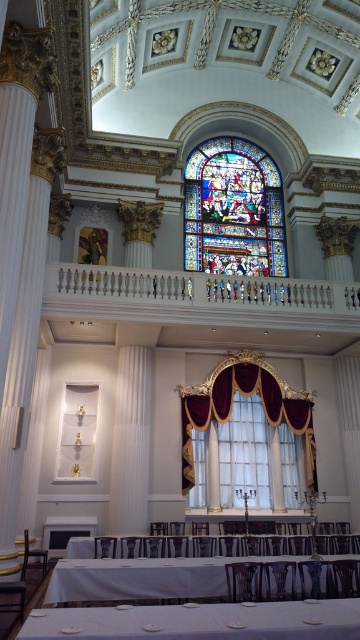
You are a guest at a formal event in this room and want to sit at the white cloth table at lower center. To do so, you need to pass through the area near the velvet curtain at right. Is the table positioned in a way that you can easily reach it without having to go around the curtain?

The white cloth table at lower center is located below the velvet curtain at right, meaning it is positioned directly underneath the curtain. This placement allows you to approach the table by moving straight towards it beneath the curtain, so you can easily reach it without needing to go around the curtain.

You are standing in the room and want to determine the spatial relationship between two points marked in the image. Which point is closer to you, point (219, 611) or point (222, 365)?

Point (219, 611) is in front of point (222, 365), so it is closer to you.

You are standing at the entrance of the room and want to place a decorative vase on the white glossy table at lower center. Based on the coordinates provided, in which direction should you move to reach the table?

The white glossy table at lower center is located at coordinates point (x=191, y=545). Since the coordinate system typically places the origin at the bottom left corner, moving towards the right and slightly upwards from the entrance would lead you to the table.